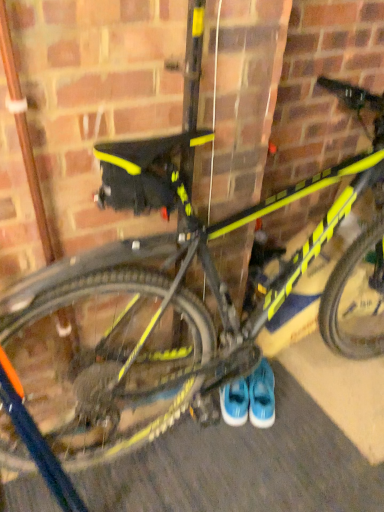
Question: Considering the positions of blue suede sneakers at center, which is the first footwear in left-to-right order, and rubberized asphalt at lower center in the image, is blue suede sneakers at center, which is the first footwear in left-to-right order, taller or shorter than rubberized asphalt at lower center?

Choices:
 (A) tall
 (B) short

Answer: (A)

Question: Considering their positions, is blue suede sneakers at center, which is the first footwear in left-to-right order, located in front of or behind rubberized asphalt at lower center?

Choices:
 (A) front
 (B) behind

Answer: (B)

Question: Which is nearer to the blue suede sneakers at center, which ranks as the second footwear in left-to-right order?

Choices:
 (A) rubberized asphalt at lower center
 (B) blue suede sneakers at center, which ranks as the 2th footwear in right-to-left order

Answer: (B)

Question: Based on their relative distances, which object is nearer to the blue suede sneakers at center, the 1th footwear positioned from the right?

Choices:
 (A) blue suede sneakers at center, which is the first footwear in left-to-right order
 (B) rubberized asphalt at lower center

Answer: (A)